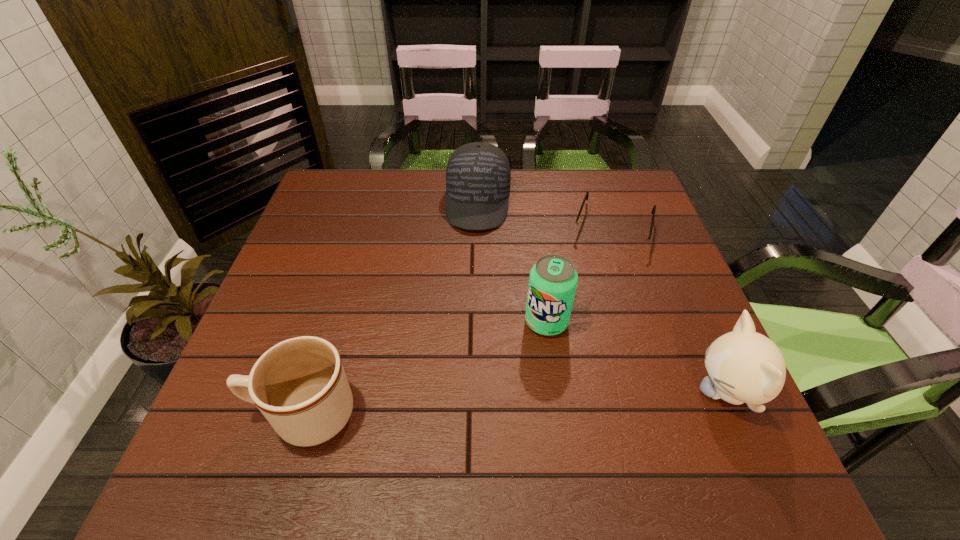
Locate an element on the screen. The width and height of the screenshot is (960, 540). vacant area between the third object from right to left and the shortest object is located at coordinates (580, 275).

This screenshot has height=540, width=960. Find the location of `free point between the kitten and the third object from left to right`. free point between the kitten and the third object from left to right is located at coordinates (636, 357).

Find the location of `vacant area that lies between the pop soda and the spectacles`. vacant area that lies between the pop soda and the spectacles is located at coordinates (580, 275).

Where is `free spot between the pop soda and the baseball cap`? The width and height of the screenshot is (960, 540). free spot between the pop soda and the baseball cap is located at coordinates (513, 262).

This screenshot has width=960, height=540. In order to click on the closest object to the leftmost object in this screenshot , I will do `click(553, 279)`.

Identify the location of object that is the nearest to the kitten. (553, 279).

Locate an element on the screen. This screenshot has width=960, height=540. free spot that satisfies the following two spatial constraints: 1. on the front side of the kitten; 2. on the face of the shortest object is located at coordinates (669, 392).

This screenshot has width=960, height=540. I want to click on vacant region that satisfies the following two spatial constraints: 1. on the front side of the shortest object; 2. on the face of the kitten, so click(x=669, y=392).

I want to click on free spot that satisfies the following two spatial constraints: 1. on the front side of the third object from left to right; 2. on the face of the kitten, so click(556, 392).

Find the location of a particular element. The height and width of the screenshot is (540, 960). vacant region that satisfies the following two spatial constraints: 1. on the front side of the fourth object from right to left; 2. on the left side of the third nearest object is located at coordinates (478, 322).